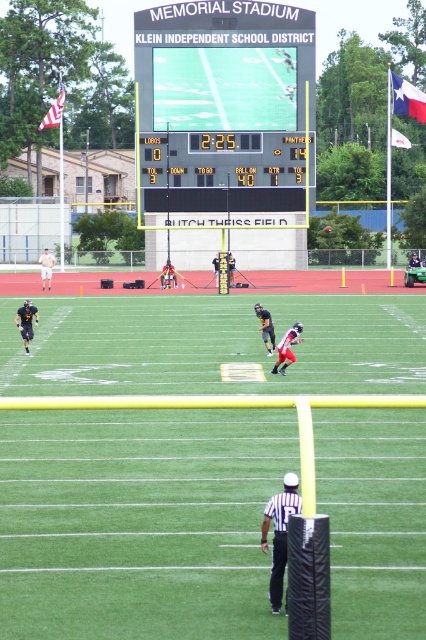
You are a spectator sitting in the stands at Memorial Stadium watching the football game between the Lobos and Panthers. You notice a white uniform at lower center and a black uniformed player at center. Which player is closer to you?

The white uniform at lower center is closer to the viewer than the black uniformed player at center.

You are a football coach analyzing the game. The point coordinates given are part of the scoreboard. What does the point at coordinates (227, 100) represent?

The point at coordinates (227, 100) indicates the black digital scoreboard at center.

You are a player wearing a white uniform at lower center. You need to throw a football to your teammate standing 12 meters away. Can you reach them without moving from your current position?

The distance between you and the viewer is 11.75 meters, which is less than 12 meters. Therefore, you can reach your teammate by throwing the ball slightly further than the current distance to them.